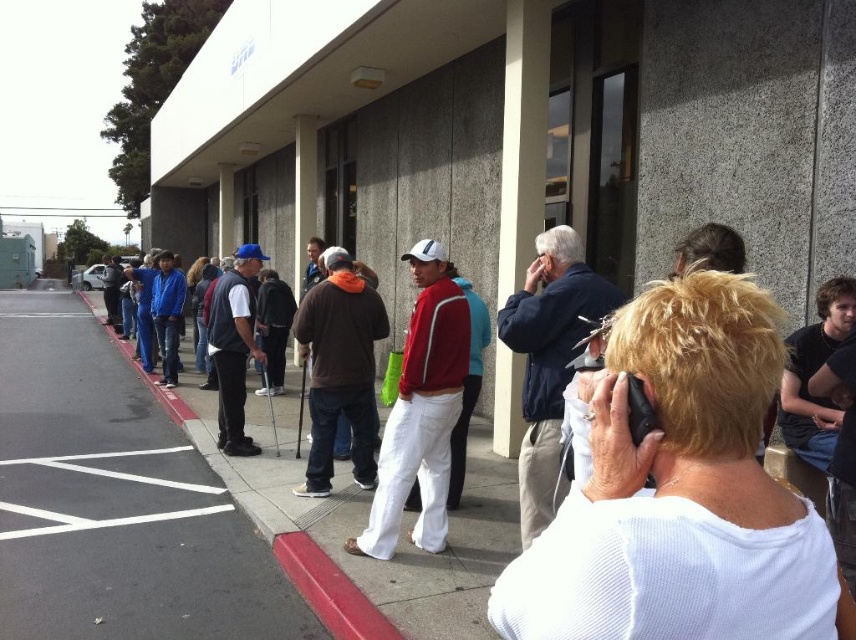
You are standing at the entrance of the building and want to direct someone to wait on the gray asphalt at left. Which direction should they move relative to the white painted line at lower left?

The gray asphalt at left is located above the white painted line at lower left, so the person should move upwards from the white painted line at lower left to reach the gray asphalt at left.

Consider the image. You are a delivery person trying to park your van near the entrance of the building. The parking area requires that the gray asphalt at left must be at least twice as wide as the white painted line at lower left to accommodate the van. Can you park here based on the scene?

The gray asphalt at left is wider than the white painted line at lower left, but it is not specified whether it is twice as wide. Therefore, it is uncertain if the parking area meets the requirement for the van.

You are a delivery person trying to park your bike near the entrance of the building. The red rubber curb at lower center and the white asphalt at lower left are both visible from your current position. Which surface should you avoid parking on to comply with parking regulations?

You should avoid parking on the red rubber curb at lower center because it is positioned under the white asphalt at lower left, indicating it might be a designated no parking area or a curb ramp meant for accessibility, which is typically marked with red rubber for visibility and regulation purposes.